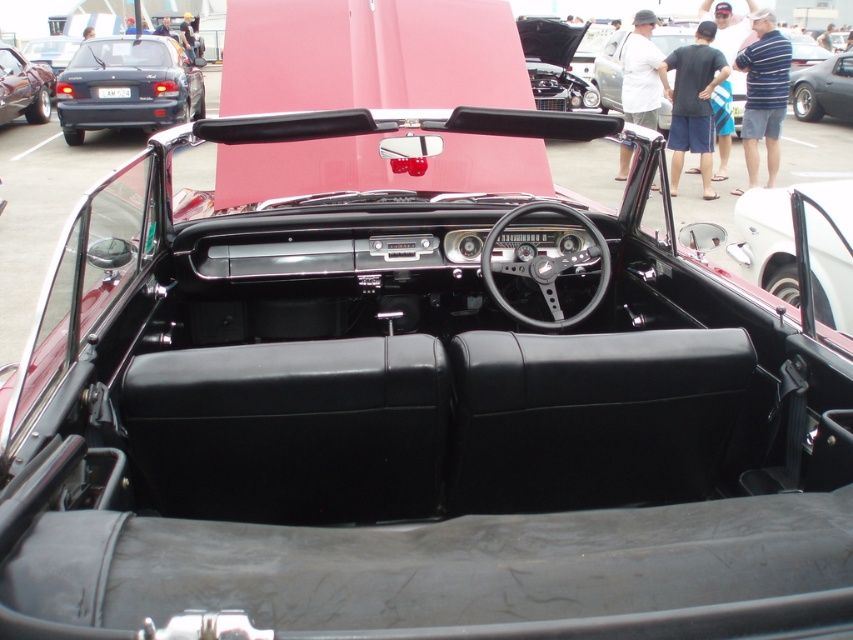
Does point (38, 70) come behind point (839, 80)?

Yes, it is.

Does shiny black convertible at left have a lesser height compared to shiny black car at upper right?

Incorrect, shiny black convertible at left's height does not fall short of shiny black car at upper right's.

Where is `shiny black convertible at left`? The image size is (853, 640). shiny black convertible at left is located at coordinates (22, 88).

The image size is (853, 640). Identify the location of shiny black convertible at left. pyautogui.click(x=22, y=88).

Does point (843, 109) lie behind point (65, 49)?

No, (843, 109) is closer to viewer.

How far apart are shiny black car at upper right and matte black convertible at center?

A distance of 16.38 meters exists between shiny black car at upper right and matte black convertible at center.

Locate an element on the screen. The height and width of the screenshot is (640, 853). shiny black car at upper right is located at coordinates (824, 90).

Measure the distance from matte black sedan at upper left to matte black convertible at center.

matte black sedan at upper left and matte black convertible at center are 5.81 meters apart.

Which is in front, point (154, 68) or point (67, 49)?

Point (154, 68)

You are a GUI agent. You are given a task and a screenshot of the screen. Output one action in this format:
    pyautogui.click(x=<x>, y=<y>)
    Task: Click on the matte black sedan at upper left
    This screenshot has height=640, width=853.
    Given the screenshot: What is the action you would take?
    pyautogui.click(x=126, y=86)

You are a GUI agent. You are given a task and a screenshot of the screen. Output one action in this format:
    pyautogui.click(x=<x>, y=<y>)
    Task: Click on the matte black sedan at upper left
    The height and width of the screenshot is (640, 853).
    Given the screenshot: What is the action you would take?
    pyautogui.click(x=126, y=86)